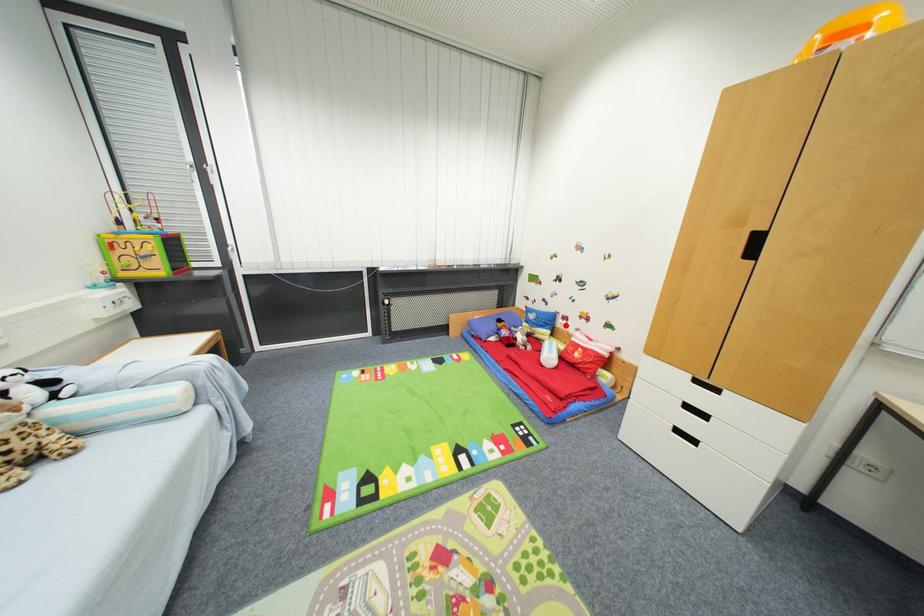
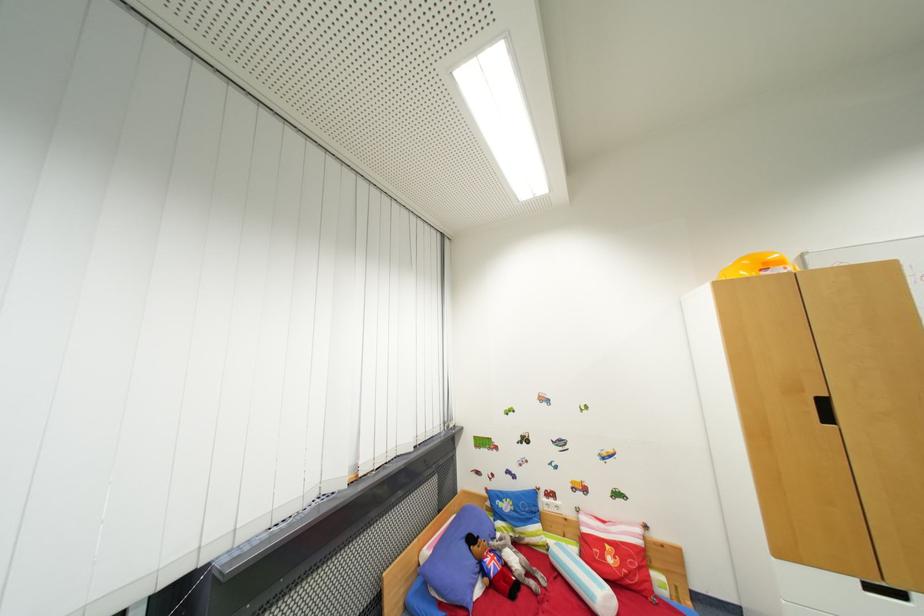
Question: I am providing you with two images of the same scene from different viewpoints. A red point is marked on the first image. At the location where the point appears in image 1, is it still visible in image 2?

Choices:
 (A) Yes
 (B) No

Answer: (A)